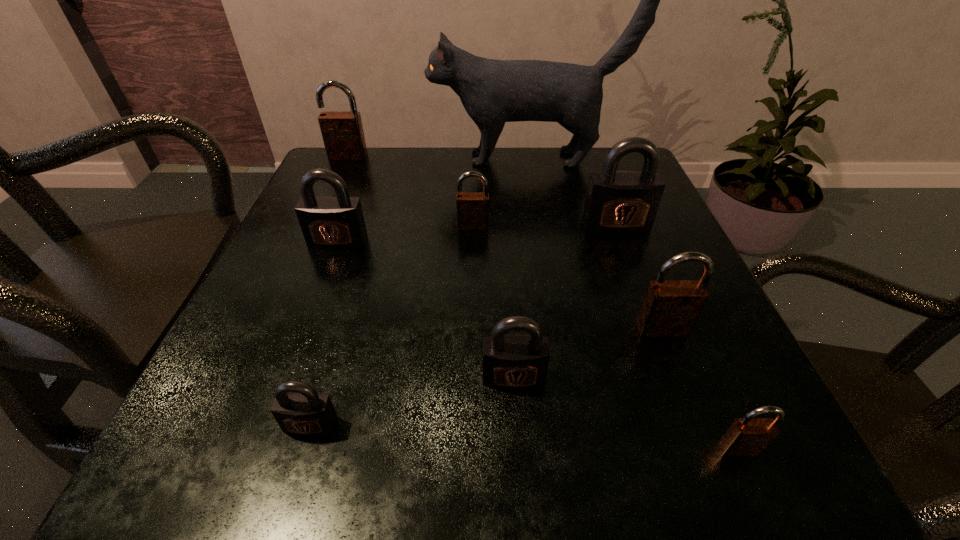
Identify the location of vacant space located on the front-facing side of the biggest brown padlock. The height and width of the screenshot is (540, 960). (340, 176).

Where is `vacant space located on the front of the second biggest gray padlock near the keyhole`? This screenshot has height=540, width=960. vacant space located on the front of the second biggest gray padlock near the keyhole is located at coordinates (294, 358).

Identify the location of vacant space located on the front-facing side of the third smallest brown padlock. (688, 396).

This screenshot has height=540, width=960. In order to click on vacant space positioned 0.230m on the front-facing side of the third biggest brown padlock in this screenshot , I will do `click(471, 320)`.

Where is `cat located at the far edge`? cat located at the far edge is located at coordinates (493, 92).

What are the coordinates of `padlock at the far edge` in the screenshot? It's located at (342, 131).

Locate an element on the screen. The width and height of the screenshot is (960, 540). cat positioned at the right edge is located at coordinates (493, 92).

Find the location of `object that is at the far left corner`. object that is at the far left corner is located at coordinates (342, 131).

Locate an element on the screen. object located at the near left corner is located at coordinates (303, 411).

Locate an element on the screen. object that is at the far right corner is located at coordinates (493, 92).